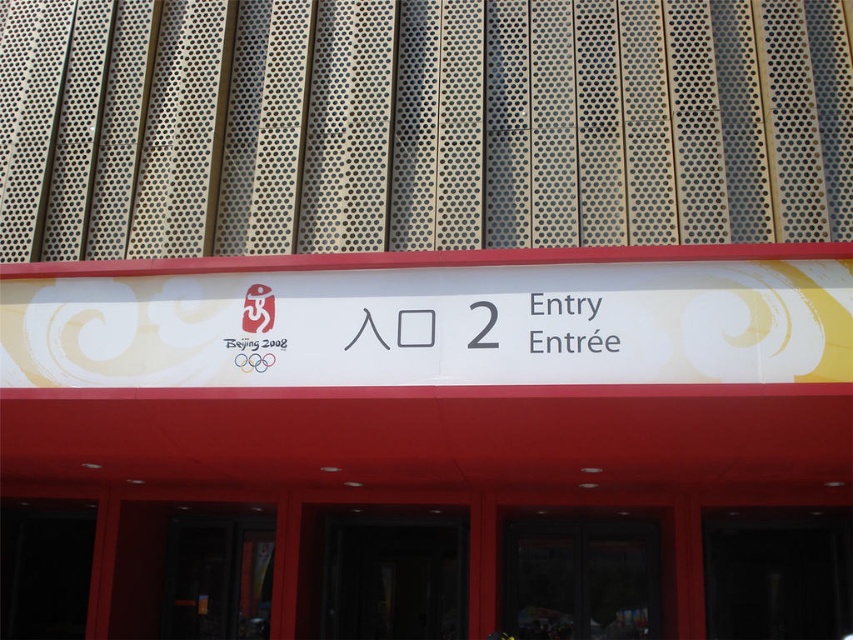
You are a delivery person trying to deliver a package to the address shown in the image. You see a dark glass door at center and a white paper at center. Which object should you interact with to enter the building?

The dark glass door at center is bigger than the white paper at center, so you should interact with the dark glass door at center to enter the building.

You are standing in front of the building entrance and want to enter. There is a white plastic sign at center and a dark glass door at center. Which object is above the other?

The white plastic sign at center is positioned over the dark glass door at center, so the sign is above the door.